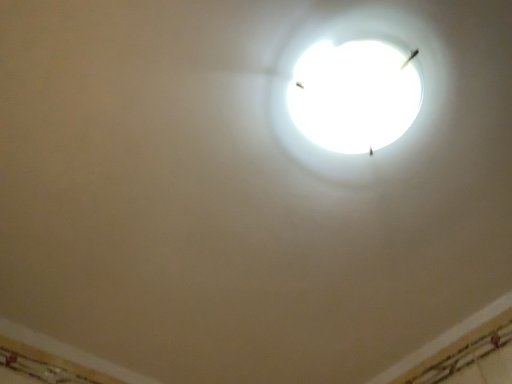
What is the approximate width of white glossy light bulb at upper center?

The width of white glossy light bulb at upper center is 9.58 inches.

What do you see at coordinates (355, 95) in the screenshot? The image size is (512, 384). I see `white glossy light bulb at upper center` at bounding box center [355, 95].

Measure the distance between white glossy light bulb at upper center and camera.

A distance of 32.01 inches exists between white glossy light bulb at upper center and camera.

This screenshot has width=512, height=384. Find the location of `white glossy light bulb at upper center`. white glossy light bulb at upper center is located at coordinates (x=355, y=95).

Identify the location of white glossy light bulb at upper center. This screenshot has height=384, width=512. (355, 95).